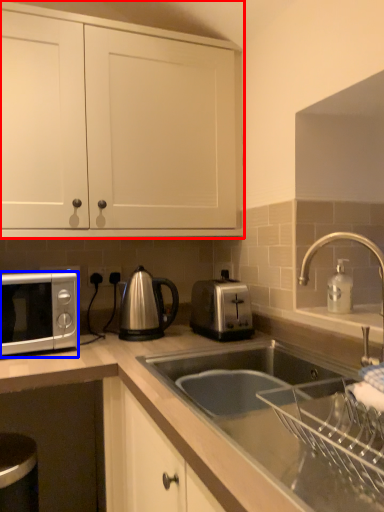
Question: Which point is further to the camera, cabinetry (highlighted by a red box) or microwave oven (highlighted by a blue box)?

Choices:
 (A) cabinetry
 (B) microwave oven

Answer: (A)